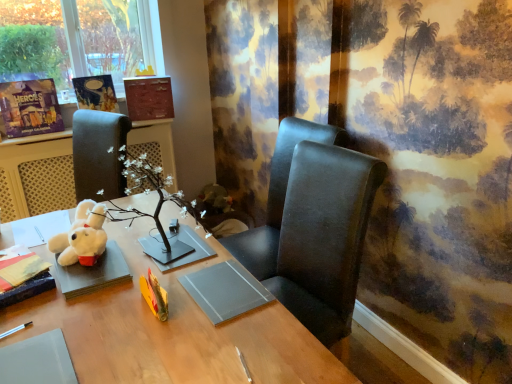
Question: From their relative heights in the image, would you say black leather chair at center, which is counted as the 1th chair, starting from the bottom, is taller or shorter than matte paper book at upper left, the second book positioned from the top?

Choices:
 (A) tall
 (B) short

Answer: (A)

Question: Is black leather chair at center, which is counted as the 1th chair, starting from the bottom, inside or outside of matte paper book at upper left, which is counted as the 3th book, starting from the bottom?

Choices:
 (A) outside
 (B) inside

Answer: (A)

Question: Which of these objects is positioned farthest from the white plush toy at left?

Choices:
 (A) matte paper book at upper left, arranged as the 3th book when viewed from the front
 (B) matte black book at lower left, arranged as the 1th book when viewed from the front
 (C) matte cardboard book at upper left, which is the 3th book in top-to-bottom order
 (D) matte brown book at upper center, the 4th book from the bottom
 (E) matte black chair at center, which is the second chair in bottom-to-top order

Answer: (B)

Question: Estimate the real-world distances between objects in this image. Which object is closer to the matte paper book at upper left, the second book positioned from the top?

Choices:
 (A) matte brown book at upper center, acting as the first book starting from the top
 (B) matte black chair at center, which is the 1th chair in top-to-bottom order
 (C) white plush toy at left
 (D) black leather chair at center, acting as the second chair starting from the top
 (E) wooden desk at center

Answer: (A)